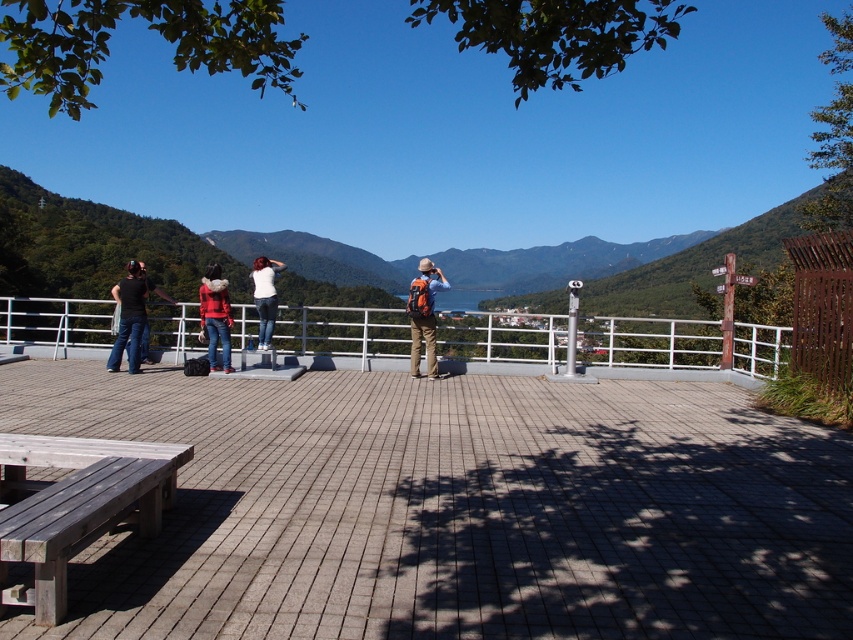
Question: Is white metal rail at center closer to camera compared to white matte shirt at center?

Choices:
 (A) yes
 (B) no

Answer: (A)

Question: Which of the following is the closest to the observer?

Choices:
 (A) (115, 339)
 (B) (757, 355)
 (C) (416, 572)
 (D) (224, 349)

Answer: (C)

Question: Which point is farther from the camera taking this photo?

Choices:
 (A) (299, 438)
 (B) (426, 340)

Answer: (B)

Question: Considering the real-world distances, which object is closest to the brown wooden deck at center?

Choices:
 (A) matte red jacket at center
 (B) matte black shirt at left

Answer: (A)

Question: Can you confirm if orange backpack at center is positioned to the right of matte red jacket at center?

Choices:
 (A) yes
 (B) no

Answer: (A)

Question: Is white metal rail at center wider than orange backpack at center?

Choices:
 (A) no
 (B) yes

Answer: (B)